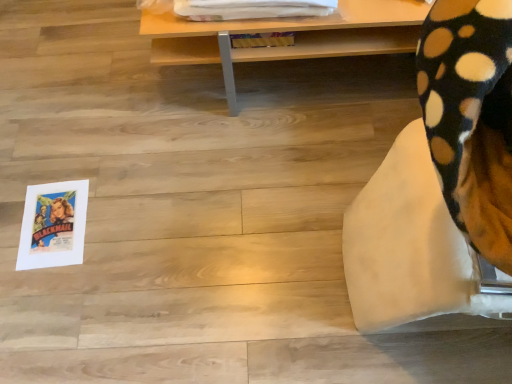
Question: Can you confirm if soft fleece blanket at lower right is positioned to the right of wooden table at upper center?

Choices:
 (A) no
 (B) yes

Answer: (B)

Question: From a real-world perspective, is soft fleece blanket at lower right beneath wooden table at upper center?

Choices:
 (A) no
 (B) yes

Answer: (A)

Question: From the image's perspective, is soft fleece blanket at lower right on wooden table at upper center?

Choices:
 (A) yes
 (B) no

Answer: (B)

Question: Can you confirm if soft fleece blanket at lower right is positioned to the left of wooden table at upper center?

Choices:
 (A) no
 (B) yes

Answer: (A)

Question: Can we say soft fleece blanket at lower right lies outside wooden table at upper center?

Choices:
 (A) yes
 (B) no

Answer: (A)

Question: From the image's perspective, would you say soft fleece blanket at lower right is shown under wooden table at upper center?

Choices:
 (A) yes
 (B) no

Answer: (A)

Question: Is wooden table at upper center facing towards soft fleece blanket at lower right?

Choices:
 (A) yes
 (B) no

Answer: (B)

Question: Considering the relative sizes of wooden table at upper center and soft fleece blanket at lower right in the image provided, is wooden table at upper center taller than soft fleece blanket at lower right?

Choices:
 (A) yes
 (B) no

Answer: (B)

Question: Can you confirm if wooden table at upper center is smaller than soft fleece blanket at lower right?

Choices:
 (A) yes
 (B) no

Answer: (A)

Question: Is wooden table at upper center next to soft fleece blanket at lower right?

Choices:
 (A) no
 (B) yes

Answer: (A)

Question: From the image's perspective, is wooden table at upper center located above soft fleece blanket at lower right?

Choices:
 (A) yes
 (B) no

Answer: (A)

Question: Does wooden table at upper center have a lesser width compared to soft fleece blanket at lower right?

Choices:
 (A) yes
 (B) no

Answer: (B)

Question: Does point (192, 61) appear closer or farther from the camera than point (422, 223)?

Choices:
 (A) farther
 (B) closer

Answer: (A)